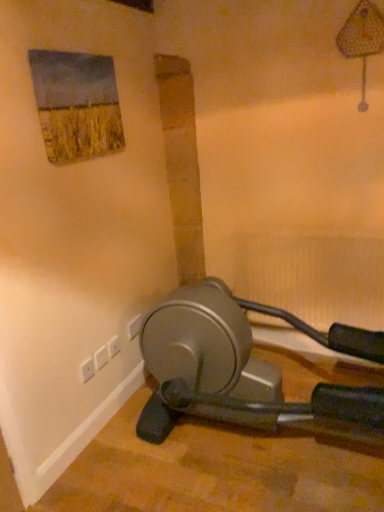
Question: Is white plastic electric outlet at lower left, the third electric outlet positioned from the right, in contact with white plastic electric outlet at lower left, arranged as the 1th electric outlet when viewed from the right?

Choices:
 (A) yes
 (B) no

Answer: (B)

Question: From the image's perspective, is white plastic electric outlet at lower left, the first electric outlet when ordered from left to right, on top of white plastic electric outlet at lower left, arranged as the 1th electric outlet when viewed from the right?

Choices:
 (A) no
 (B) yes

Answer: (A)

Question: Is the position of white plastic electric outlet at lower left, the 3th electric outlet positioned from the back, less distant than that of white plastic electric outlet at lower left, arranged as the 1th electric outlet when viewed from the right?

Choices:
 (A) no
 (B) yes

Answer: (B)

Question: Is white plastic electric outlet at lower left, the third electric outlet positioned from the right, positioned behind white plastic electric outlet at lower left, arranged as the 1th electric outlet when viewed from the right?

Choices:
 (A) yes
 (B) no

Answer: (B)

Question: Can you confirm if white plastic electric outlet at lower left, which is the first electric outlet in front-to-back order, is shorter than white plastic electric outlet at lower left, acting as the 1th electric outlet starting from the back?

Choices:
 (A) yes
 (B) no

Answer: (A)

Question: Is white plastic electric outlet at lower left, the 3th electric outlet positioned from the back, to the left of white plastic electric outlet at lower left, arranged as the 3th electric outlet when viewed from the left, from the viewer's perspective?

Choices:
 (A) no
 (B) yes

Answer: (B)

Question: Can you confirm if white plastic electric outlet at lower left, the third electric outlet positioned from the right, is thinner than white plastic plug at lower left?

Choices:
 (A) yes
 (B) no

Answer: (B)

Question: Does white plastic electric outlet at lower left, the third electric outlet positioned from the right, lie behind white plastic plug at lower left?

Choices:
 (A) yes
 (B) no

Answer: (B)

Question: Considering the relative sizes of white plastic electric outlet at lower left, the third electric outlet positioned from the right, and white plastic plug at lower left in the image provided, is white plastic electric outlet at lower left, the third electric outlet positioned from the right, taller than white plastic plug at lower left?

Choices:
 (A) no
 (B) yes

Answer: (A)

Question: Could you tell me if white plastic electric outlet at lower left, which is the first electric outlet in front-to-back order, is facing white plastic plug at lower left?

Choices:
 (A) no
 (B) yes

Answer: (A)

Question: Does white plastic electric outlet at lower left, the third electric outlet positioned from the right, have a smaller size compared to white plastic plug at lower left?

Choices:
 (A) yes
 (B) no

Answer: (A)

Question: Does white plastic electric outlet at lower left, which is the first electric outlet in front-to-back order, touch white plastic plug at lower left?

Choices:
 (A) yes
 (B) no

Answer: (A)

Question: From a real-world perspective, is white plastic plug at lower left below white plastic electric outlet at lower left, the 3th electric outlet positioned from the back?

Choices:
 (A) no
 (B) yes

Answer: (B)